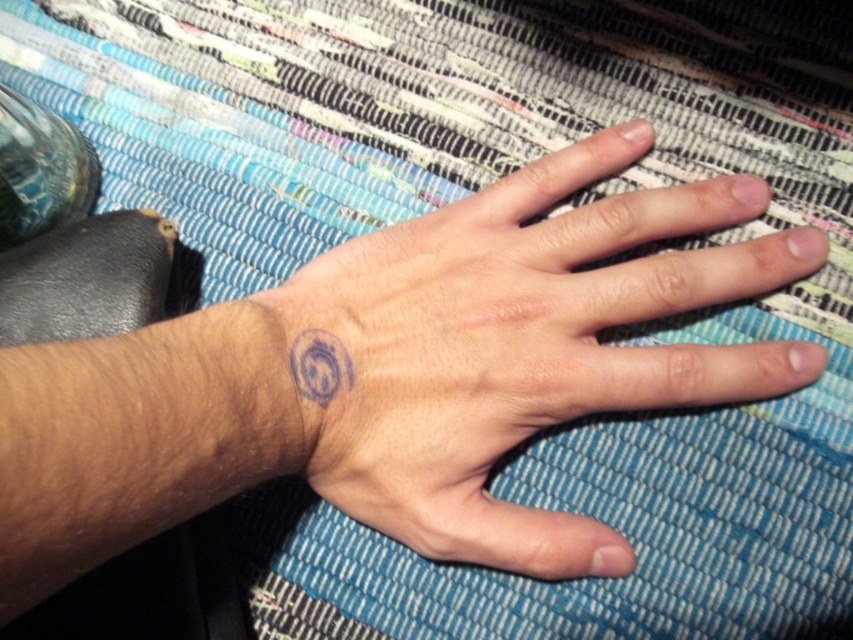
Question: Where is purple ink tattoo at center located in relation to blue ink tattoo at wrist in the image?

Choices:
 (A) right
 (B) left

Answer: (A)

Question: Which of the following is the closest to the observer?

Choices:
 (A) (479, 504)
 (B) (312, 333)

Answer: (B)

Question: Can you confirm if purple ink tattoo at center is positioned above blue ink tattoo at wrist?

Choices:
 (A) no
 (B) yes

Answer: (B)

Question: Can you confirm if purple ink tattoo at center is wider than blue ink tattoo at wrist?

Choices:
 (A) no
 (B) yes

Answer: (B)

Question: Which object appears closest to the camera in this image?

Choices:
 (A) purple ink tattoo at center
 (B) blue ink tattoo at wrist

Answer: (A)

Question: Which of the following is the farthest from the observer?

Choices:
 (A) (321, 339)
 (B) (695, 394)

Answer: (B)